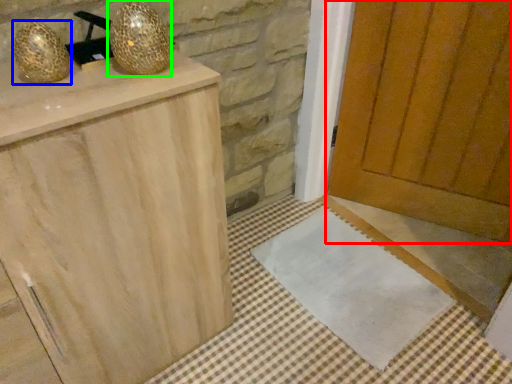
Question: Based on their relative distances, which object is nearer to door (highlighted by a red box)? Choose from disco ball (highlighted by a blue box) and disco ball (highlighted by a green box).

Choices:
 (A) disco ball
 (B) disco ball

Answer: (B)